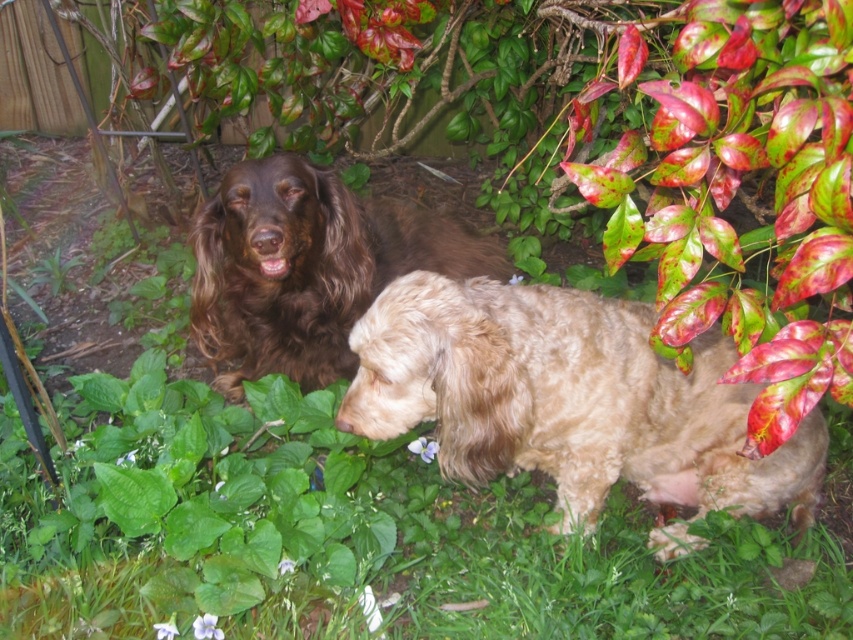
Does light brown fur at center appear over brown fluffy dog at center?

No, light brown fur at center is not above brown fluffy dog at center.

Is light brown fur at center further to the viewer compared to brown fluffy dog at center?

No, light brown fur at center is in front of brown fluffy dog at center.

Who is more distant from viewer, [512,346] or [361,291]?

Point [361,291]

The height and width of the screenshot is (640, 853). I want to click on light brown fur at center, so click(x=569, y=397).